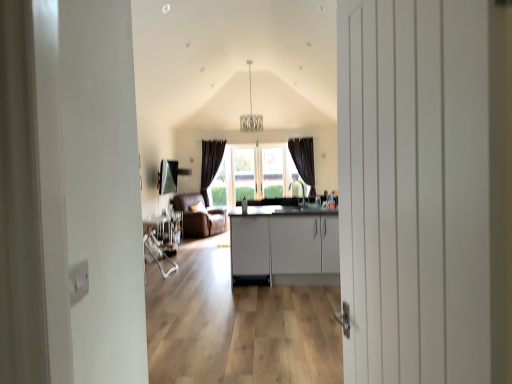
This screenshot has height=384, width=512. I want to click on brown leather armchair at center, so click(199, 217).

I want to click on metallic silver table at center, so click(165, 231).

Locate an element on the screen. This screenshot has height=384, width=512. brown leather armchair at center is located at coordinates (199, 217).

Where is `armchair lying on the right of metallic silver table at center`? armchair lying on the right of metallic silver table at center is located at coordinates (199, 217).

Looking at this image, who is taller, metallic silver table at center or brown leather armchair at center?

brown leather armchair at center is taller.

Is metallic silver table at center surrounding brown leather armchair at center?

Actually, brown leather armchair at center is outside metallic silver table at center.

Does white wooden door at center appear on the left side of brown leather armchair at center?

No, white wooden door at center is not to the left of brown leather armchair at center.

From a real-world perspective, is white wooden door at center physically above brown leather armchair at center?

Yes, from a real-world perspective, white wooden door at center is over brown leather armchair at center

You are a GUI agent. You are given a task and a screenshot of the screen. Output one action in this format:
    pyautogui.click(x=<x>, y=<y>)
    Task: Click on the door in front of the brown leather armchair at center
    The height and width of the screenshot is (384, 512).
    Given the screenshot: What is the action you would take?
    pyautogui.click(x=422, y=190)

How different are the orientations of white matte cabinet at center and metallic silver table at center in degrees?

89.5 degrees separate the facing orientations of white matte cabinet at center and metallic silver table at center.

Considering the points (335, 268) and (179, 225), which point is in front, point (335, 268) or point (179, 225)?

The point (335, 268) is more forward.

From a real-world perspective, between white matte cabinet at center and metallic silver table at center, who is vertically higher?

white matte cabinet at center, from a real-world perspective.

Is white matte cabinet at center turned away from metallic silver table at center?

No, metallic silver table at center is not at the back of white matte cabinet at center.

From a real-world perspective, is metallic silver table at center on white matte cabinet at center?

No, from a real-world perspective, metallic silver table at center is not on top of white matte cabinet at center.

Can you tell me how much metallic silver table at center and white matte cabinet at center differ in facing direction?

The angle between the facing direction of metallic silver table at center and the facing direction of white matte cabinet at center is 89.5 degrees.

From the image's perspective, is metallic silver table at center positioned above or below white matte cabinet at center?

Clearly, from the image's perspective, metallic silver table at center is below white matte cabinet at center.

In the scene shown: Who is more distant, metallic silver table at center or white matte cabinet at center?

metallic silver table at center.

Who is shorter, brown leather armchair at center or white wooden door at center?

brown leather armchair at center.

Is white wooden door at center a part of brown leather armchair at center?

That's incorrect, white wooden door at center is not inside brown leather armchair at center.

Which object is closer to the camera taking this photo, brown leather armchair at center or white wooden door at center?

white wooden door at center is more forward.

From the image's perspective, is white matte cabinet at center positioned above or below brown leather armchair at center?

white matte cabinet at center is situated lower than brown leather armchair at center in the image.

In the scene shown: Is white matte cabinet at center positioned beyond the bounds of brown leather armchair at center?

Yes, white matte cabinet at center is located beyond the bounds of brown leather armchair at center.

Does white matte cabinet at center come behind brown leather armchair at center?

No, white matte cabinet at center is closer to the viewer.

Would you say metallic silver table at center is to the left or to the right of white wooden door at center in the picture?

Clearly, metallic silver table at center is on the left of white wooden door at center in the image.

Based on the photo, from a real-world perspective, is metallic silver table at center positioned above or below white wooden door at center?

metallic silver table at center is situated lower than white wooden door at center in the real world.

Measure the distance between metallic silver table at center and white wooden door at center.

metallic silver table at center and white wooden door at center are 6.03 meters apart from each other.

Considering the sizes of metallic silver table at center and white wooden door at center in the image, is metallic silver table at center bigger or smaller than white wooden door at center?

Clearly, metallic silver table at center is smaller in size than white wooden door at center.

At what (x,y) coordinates should I click in order to perform the action: click on armchair above the metallic silver table at center (from the image's perspective). Please return your answer as a coordinate pair (x, y). Looking at the image, I should click on (199, 217).

Find the location of `door positioned vertically above the brown leather armchair at center (from a real-world perspective)`. door positioned vertically above the brown leather armchair at center (from a real-world perspective) is located at coordinates (422, 190).

Which object lies nearer to the anchor point white matte cabinet at center, white wooden door at center or metallic silver table at center?

Among the two, metallic silver table at center is located nearer to white matte cabinet at center.

Looking at the image, which one is located closer to white wooden door at center, metallic silver table at center or brown leather armchair at center?

metallic silver table at center.

When comparing their distances from metallic silver table at center, does brown leather armchair at center or white wooden door at center seem further?

white wooden door at center is further to metallic silver table at center.

When comparing their distances from brown leather armchair at center, does white matte cabinet at center or metallic silver table at center seem further?

white matte cabinet at center.

From the image, which object appears to be nearer to white matte cabinet at center, metallic silver table at center or brown leather armchair at center?

Among the two, metallic silver table at center is located nearer to white matte cabinet at center.

From the picture: Looking at the image, which one is located further to white matte cabinet at center, brown leather armchair at center or metallic silver table at center?

brown leather armchair at center is positioned further to the anchor white matte cabinet at center.

In the scene shown: When comparing their distances from brown leather armchair at center, does metallic silver table at center or white wooden door at center seem further?

white wooden door at center is further to brown leather armchair at center.

Considering their positions, is metallic silver table at center positioned closer to white wooden door at center than white matte cabinet at center?

Based on the image, white matte cabinet at center appears to be nearer to white wooden door at center.

Locate an element on the screen. This screenshot has height=384, width=512. cabinetry between white wooden door at center and metallic silver table at center along the z-axis is located at coordinates (285, 246).

At what (x,y) coordinates should I click in order to perform the action: click on cabinetry located between white wooden door at center and brown leather armchair at center in the depth direction. Please return your answer as a coordinate pair (x, y). Looking at the image, I should click on (285, 246).

In order to click on table between white wooden door at center and brown leather armchair at center along the z-axis in this screenshot , I will do `click(165, 231)`.

Where is `table located between white matte cabinet at center and brown leather armchair at center in the depth direction`? table located between white matte cabinet at center and brown leather armchair at center in the depth direction is located at coordinates (165, 231).